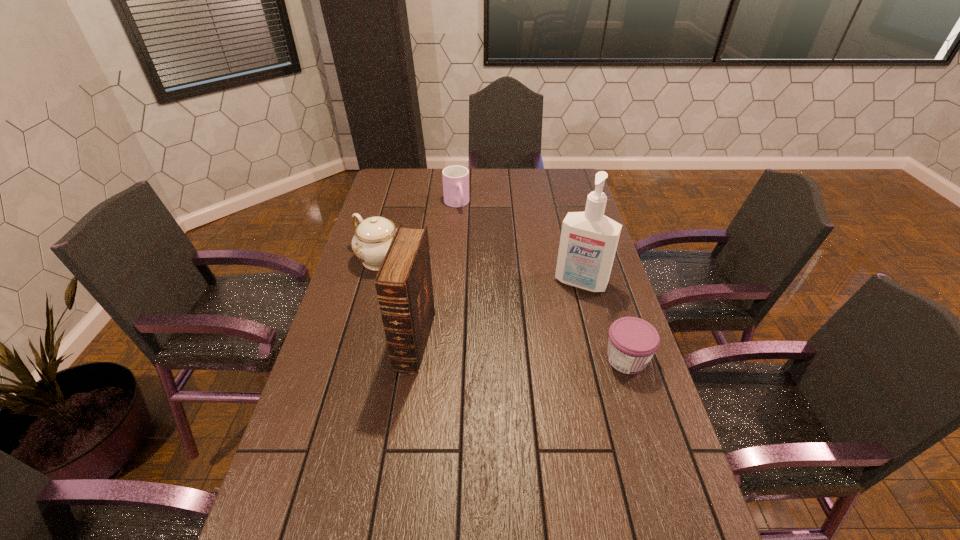
Identify the location of free space on the desktop that is between the second tallest object and the shortest object and is positioned on the front label of the tallest object. (549, 353).

Find the location of a particular element. This screenshot has width=960, height=540. free space on the desktop that is between the Bible and the jam and is positioned with the handle on the side of the cup is located at coordinates (520, 350).

This screenshot has width=960, height=540. In order to click on free space on the desktop that is between the fourth shortest object and the shortest object and is positioned at the spout of the third tallest object in this screenshot , I will do `click(506, 349)`.